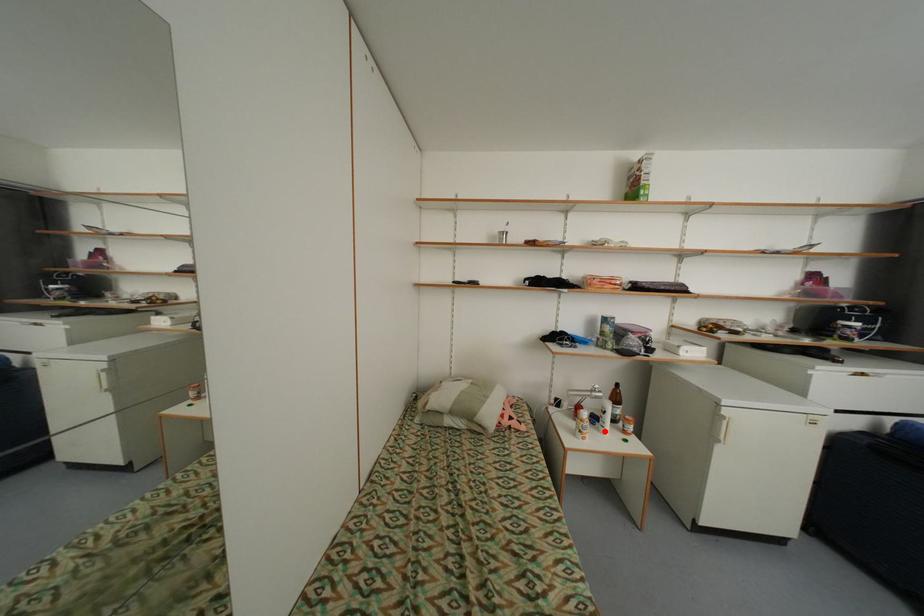
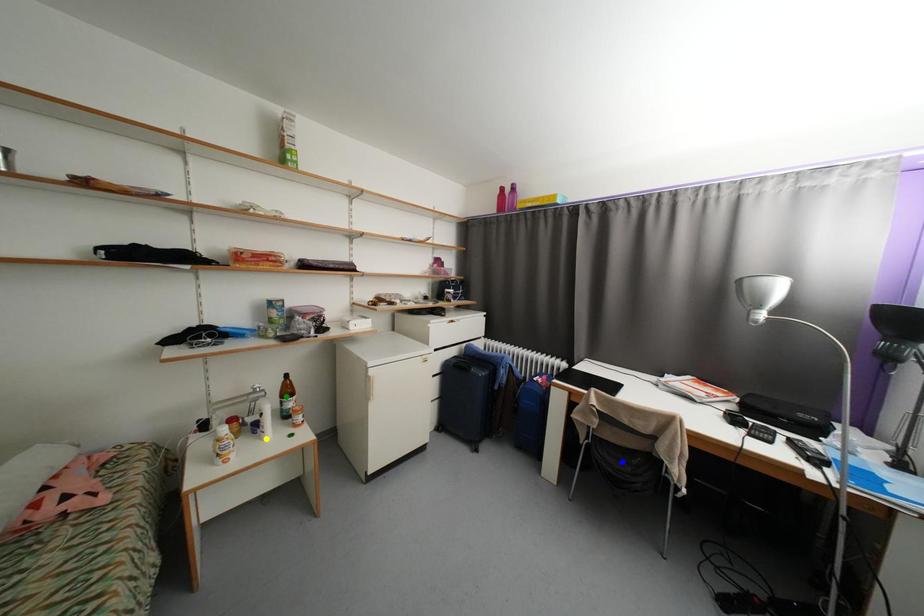
Question: I am providing you with two images of the same scene from different viewpoints. A red point is marked on the first image. You are given multiple points on the second image. Which spot in image 2 lines up with the point in image 1?

Choices:
 (A) green point
 (B) yellow point
 (C) blue point

Answer: (B)